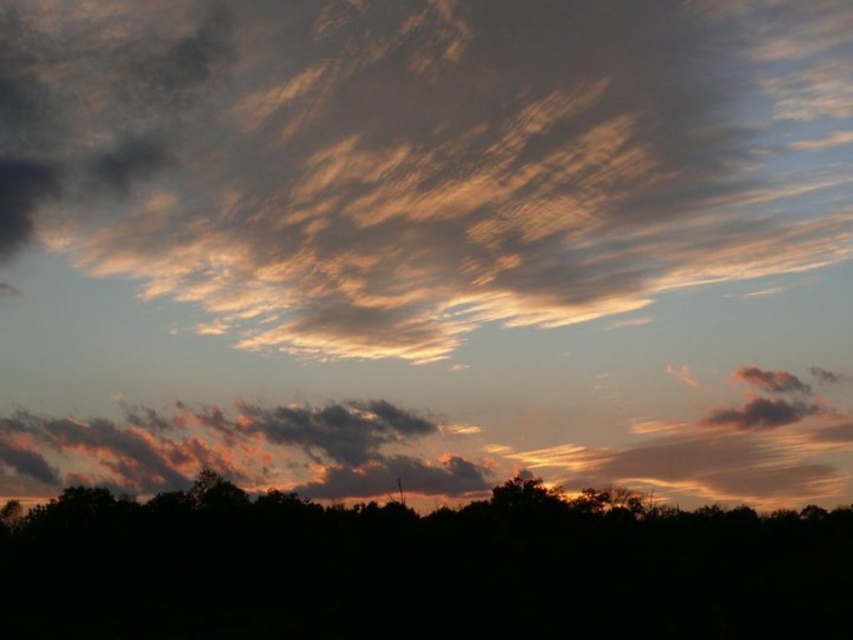
You are an artist trying to paint the sunset scene. You need to decide the vertical positioning of the golden textured clouds at upper center and the black matte tree at bottom. Based on the scene, which object should be placed higher in your painting?

The golden textured clouds at upper center should be placed higher in the painting since they are taller than the black matte tree at bottom according to the description.

You are an artist painting the sunset scene. You want to place a small bird between the golden textured clouds at upper center and the black matte tree at bottom. Where should you position the bird to ensure it is between them?

The golden textured clouds at upper center is positioned on the left side of black matte tree at bottom, so you should place the bird between them to the right of the golden textured clouds at upper center and to the left of the black matte tree at bottom.

You are an artist planning to paint the sunset scene. You want to ensure the golden textured clouds at upper center and the black matte tree at bottom are proportionally accurate. Which object should you make narrower in your painting?

The golden textured clouds at upper center should be made narrower since its width is less than the black matte tree at bottom.